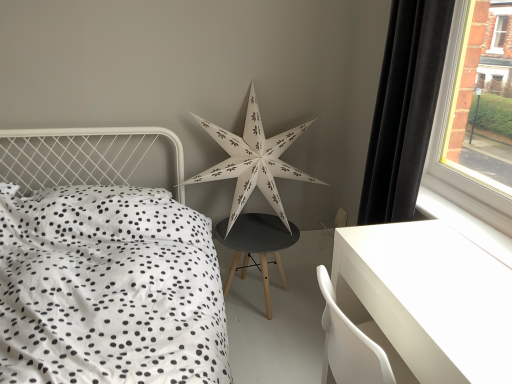
Question: Is white paper star at center positioned beyond the bounds of black matte stool at center?

Choices:
 (A) no
 (B) yes

Answer: (B)

Question: Can you confirm if white paper star at center is wider than black matte stool at center?

Choices:
 (A) no
 (B) yes

Answer: (A)

Question: Is white paper star at center touching black matte stool at center?

Choices:
 (A) yes
 (B) no

Answer: (B)

Question: Is white paper star at center thinner than black matte stool at center?

Choices:
 (A) yes
 (B) no

Answer: (A)

Question: From a real-world perspective, is white paper star at center physically below black matte stool at center?

Choices:
 (A) yes
 (B) no

Answer: (B)

Question: Is black matte stool at center completely or partially inside white paper star at center?

Choices:
 (A) no
 (B) yes

Answer: (A)

Question: Does white dotted fabric at left turn towards black matte stool at center?

Choices:
 (A) yes
 (B) no

Answer: (B)

Question: Is white dotted fabric at left smaller than black matte stool at center?

Choices:
 (A) no
 (B) yes

Answer: (A)

Question: Would you say white dotted fabric at left contains black matte stool at center?

Choices:
 (A) no
 (B) yes

Answer: (A)

Question: Is white dotted fabric at left at the left side of black matte stool at center?

Choices:
 (A) yes
 (B) no

Answer: (A)

Question: From the image's perspective, is white dotted fabric at left above black matte stool at center?

Choices:
 (A) yes
 (B) no

Answer: (A)

Question: Does white dotted fabric at left have a lesser height compared to black matte stool at center?

Choices:
 (A) no
 (B) yes

Answer: (A)

Question: Considering the relative positions of white paper star at center and white dotted fabric at left in the image provided, is white paper star at center to the right of white dotted fabric at left from the viewer's perspective?

Choices:
 (A) no
 (B) yes

Answer: (B)